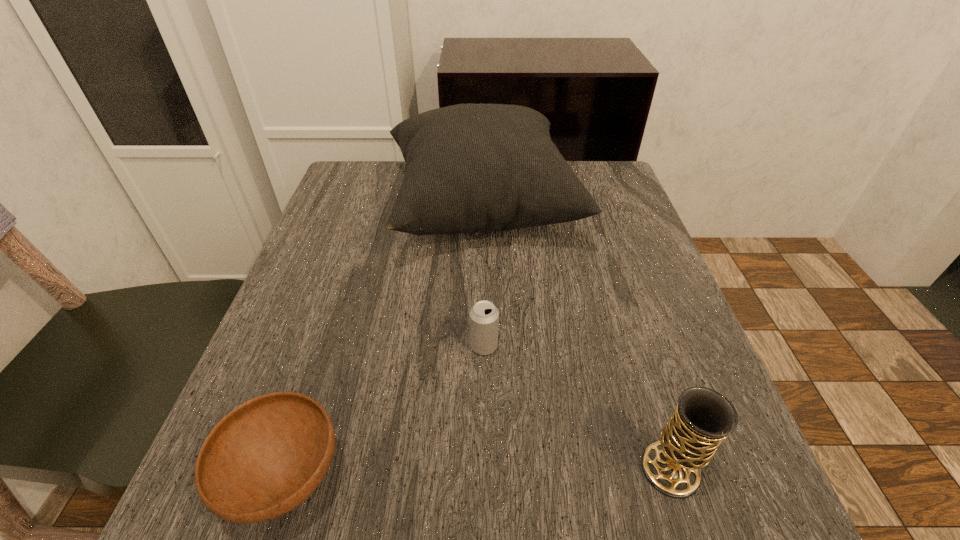
I want to click on the tallest object, so click(x=470, y=167).

Image resolution: width=960 pixels, height=540 pixels. What are the coordinates of `the farthest object` in the screenshot? It's located at (470, 167).

This screenshot has height=540, width=960. In order to click on the second tallest object in this screenshot , I will do `click(703, 418)`.

What are the coordinates of `the second farthest object` in the screenshot? It's located at (484, 316).

Image resolution: width=960 pixels, height=540 pixels. Identify the location of free space located on the right of the tallest object. (603, 209).

You are a GUI agent. You are given a task and a screenshot of the screen. Output one action in this format:
    pyautogui.click(x=<x>, y=<y>)
    Task: Click on the vacant space located 0.140m on the left of the chalice
    The image size is (960, 540).
    Given the screenshot: What is the action you would take?
    pyautogui.click(x=540, y=470)

The width and height of the screenshot is (960, 540). In order to click on free space located 0.200m on the right of the beer can in this screenshot , I will do `click(614, 346)`.

You are a GUI agent. You are given a task and a screenshot of the screen. Output one action in this format:
    pyautogui.click(x=<x>, y=<y>)
    Task: Click on the object at the far edge
    The width and height of the screenshot is (960, 540).
    Given the screenshot: What is the action you would take?
    pyautogui.click(x=470, y=167)

At what (x,y) coordinates should I click in order to perform the action: click on object present at the near edge. Please return your answer as a coordinate pair (x, y). Image resolution: width=960 pixels, height=540 pixels. Looking at the image, I should click on (703, 418).

Where is `object located at the left edge`? This screenshot has width=960, height=540. object located at the left edge is located at coordinates (470, 167).